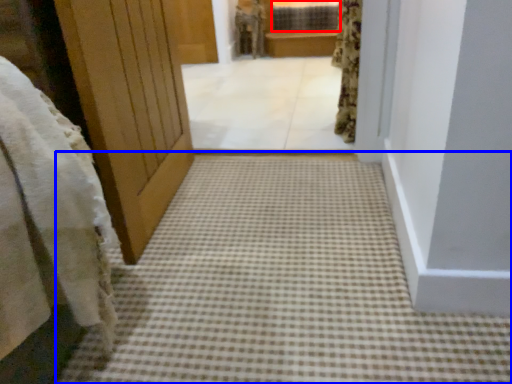
Question: Which object appears farthest to the camera in this image, window (highlighted by a red box) or path (highlighted by a blue box)?

Choices:
 (A) window
 (B) path

Answer: (A)